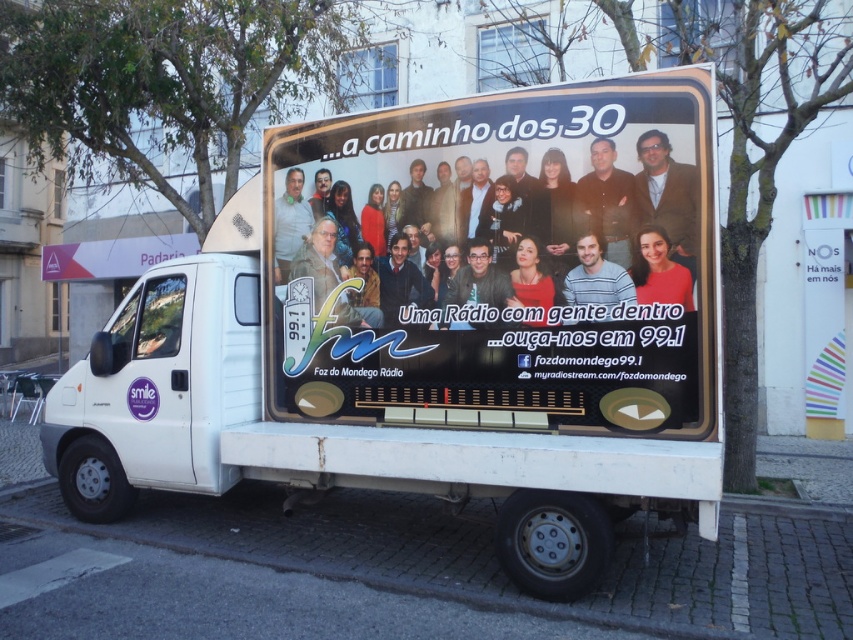
Question: Which object is positioned farthest from the smooth skin face at center?

Choices:
 (A) dark gray shirt at center
 (B) matte black glasses at center
 (C) matte red shirt at center

Answer: (B)

Question: Does white glossy truck at center appear on the right side of dark gray shirt at center?

Choices:
 (A) no
 (B) yes

Answer: (A)

Question: Which object is the farthest from the matte black face at center?

Choices:
 (A) dark gray shirt at center
 (B) matte white shirt at left
 (C) matte brown jacket at upper right

Answer: (B)

Question: Is white glossy truck at center to the right of matte white shirt at left from the viewer's perspective?

Choices:
 (A) no
 (B) yes

Answer: (B)

Question: Which point appears closest to the camera in this image?

Choices:
 (A) click(x=683, y=296)
 (B) click(x=299, y=177)
 (C) click(x=535, y=385)

Answer: (A)

Question: Can you confirm if matte black glasses at center is positioned to the right of matte red shirt at center?

Choices:
 (A) yes
 (B) no

Answer: (B)